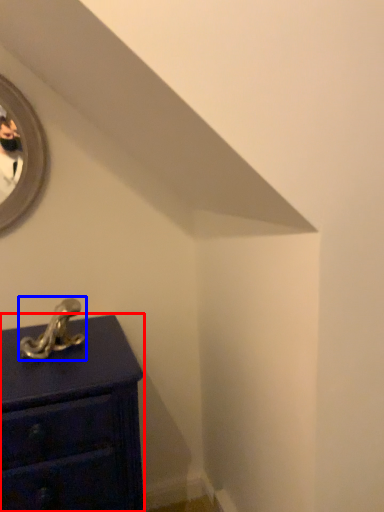
Question: Which object is closer to the camera taking this photo, chest of drawers (highlighted by a red box) or antique (highlighted by a blue box)?

Choices:
 (A) chest of drawers
 (B) antique

Answer: (A)